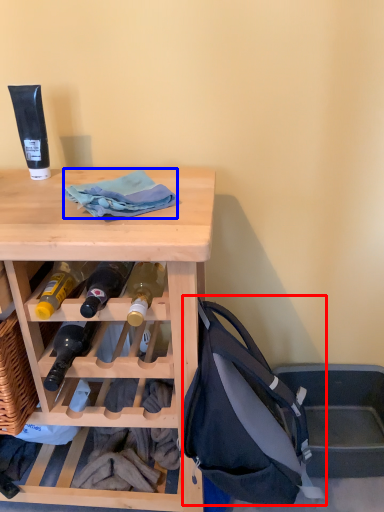
Question: Which object is closer to the camera taking this photo, handbag (highlighted by a red box) or cloth (highlighted by a blue box)?

Choices:
 (A) handbag
 (B) cloth

Answer: (A)